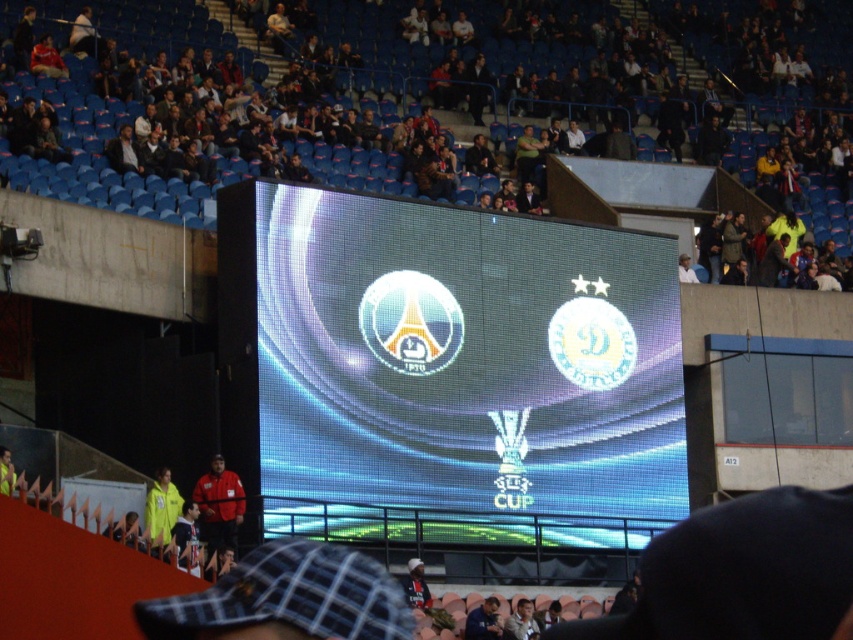
Based on the photo, you are a photographer trying to capture a clear photo of the UEFA Cup logo displayed on the LED screen. You notice the dark blue seats at upper center and the red jacket at lower left. Which object is blocking your view of the logo?

The red jacket at lower left is behind dark blue seats at upper center, so the dark blue seats at upper center are blocking the view of the UEFA Cup logo.

You are a drone operator trying to capture aerial footage of the UEFA Cup match. You have two points marked on your screen for camera positioning. The first point is at coordinates point (x=473, y=81), and the second is at point (x=200, y=481). Based on the stadium layout, which point is closer to the LED screen displaying the team logos?

Point (x=200, y=481) is closer to the LED screen displaying the team logos because point (x=473, y=81) is behind it.

You are a photographer trying to capture the UEFA Cup match highlights. You need to focus on both the dark blue seats at upper center and the shiny led display at center. Which object should you adjust your camera settings for first to ensure proper exposure?

The dark blue seats at upper center is larger in size than the shiny led display at center, so you should adjust your camera settings for the dark blue seats at upper center first to ensure proper exposure.